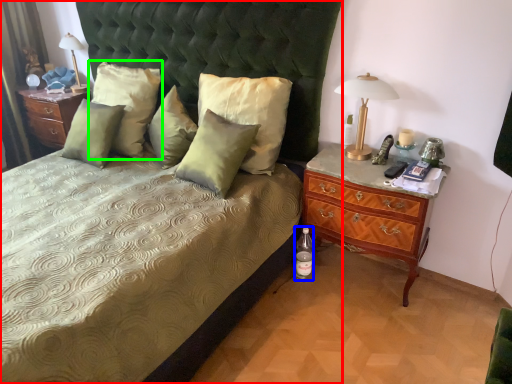
Question: Which is nearer to the bed (highlighted by a red box)? bottle (highlighted by a blue box) or pillow (highlighted by a green box).

Choices:
 (A) bottle
 (B) pillow

Answer: (B)